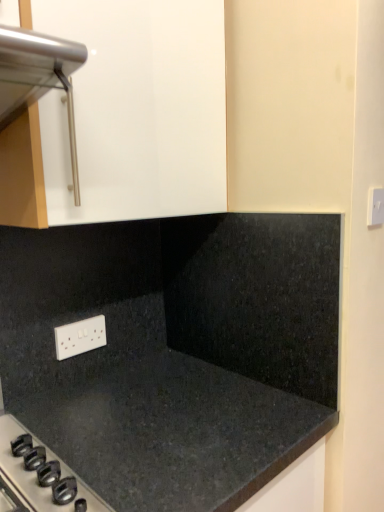
What is the approximate height of white plastic electric outlet at upper right, the 1th electric outlet in the top-to-bottom sequence?

3.45 inches.

The height and width of the screenshot is (512, 384). I want to click on black granite countertop at lower left, so click(x=175, y=351).

I want to click on white plastic electric outlet at lower left, placed as the second electric outlet when sorted from top to bottom, so click(80, 337).

Image resolution: width=384 pixels, height=512 pixels. I want to click on white plastic electric outlet at upper right, placed as the first electric outlet when sorted from front to back, so click(x=375, y=206).

Considering the relative sizes of white plastic electric outlet at lower left, marked as the first electric outlet in a bottom-to-top arrangement, and black granite countertop at lower left in the image provided, is white plastic electric outlet at lower left, marked as the first electric outlet in a bottom-to-top arrangement, shorter than black granite countertop at lower left?

Yes, white plastic electric outlet at lower left, marked as the first electric outlet in a bottom-to-top arrangement, is shorter than black granite countertop at lower left.

Is white plastic electric outlet at lower left, the second electric outlet in the front-to-back sequence, wider than black granite countertop at lower left?

No, white plastic electric outlet at lower left, the second electric outlet in the front-to-back sequence, is not wider than black granite countertop at lower left.

From the image's perspective, which electric outlet is the 1st one above the black granite countertop at lower left? Please provide its 2D coordinates.

[(80, 337)]

How many degrees apart are the facing directions of white plastic electric outlet at lower left, marked as the first electric outlet in a bottom-to-top arrangement, and black granite countertop at lower left?

There is a 0.499-degree angle between the facing directions of white plastic electric outlet at lower left, marked as the first electric outlet in a bottom-to-top arrangement, and black granite countertop at lower left.

Is white plastic electric outlet at upper right, placed as the first electric outlet when sorted from front to back, bigger or smaller than white plastic electric outlet at lower left, marked as the first electric outlet in a bottom-to-top arrangement?

In the image, white plastic electric outlet at upper right, placed as the first electric outlet when sorted from front to back, appears to be smaller than white plastic electric outlet at lower left, marked as the first electric outlet in a bottom-to-top arrangement.

Which is behind, white plastic electric outlet at upper right, placed as the first electric outlet when sorted from front to back, or white plastic electric outlet at lower left, placed as the second electric outlet when sorted from top to bottom?

Positioned behind is white plastic electric outlet at lower left, placed as the second electric outlet when sorted from top to bottom.

From the image's perspective, is white plastic electric outlet at upper right, marked as the second electric outlet in a back-to-front arrangement, over white plastic electric outlet at lower left, marked as the first electric outlet in a bottom-to-top arrangement?

Yes, from the image's perspective, white plastic electric outlet at upper right, marked as the second electric outlet in a back-to-front arrangement, is over white plastic electric outlet at lower left, marked as the first electric outlet in a bottom-to-top arrangement.

Looking at their sizes, would you say white plastic electric outlet at upper right, placed as the second electric outlet when sorted from bottom to top, is wider or thinner than white plastic electric outlet at lower left, positioned as the 1th electric outlet in left-to-right order?

In the image, white plastic electric outlet at upper right, placed as the second electric outlet when sorted from bottom to top, appears to be wider than white plastic electric outlet at lower left, positioned as the 1th electric outlet in left-to-right order.

Who is more distant, black granite countertop at lower left or white plastic electric outlet at upper right, marked as the second electric outlet in a back-to-front arrangement?

white plastic electric outlet at upper right, marked as the second electric outlet in a back-to-front arrangement, is behind.

Does black granite countertop at lower left contain white plastic electric outlet at upper right, marked as the second electric outlet in a back-to-front arrangement?

Actually, white plastic electric outlet at upper right, marked as the second electric outlet in a back-to-front arrangement, is outside black granite countertop at lower left.

From a real-world perspective, which is physically below, black granite countertop at lower left or white plastic electric outlet at upper right, which is the second electric outlet in left-to-right order?

In real-world perspective, black granite countertop at lower left is lower.

Considering the relative sizes of black granite countertop at lower left and white plastic electric outlet at upper right, placed as the first electric outlet when sorted from front to back, in the image provided, is black granite countertop at lower left thinner than white plastic electric outlet at upper right, placed as the first electric outlet when sorted from front to back,?

Incorrect, the width of black granite countertop at lower left is not less than that of white plastic electric outlet at upper right, placed as the first electric outlet when sorted from front to back.

Considering the relative positions of black granite countertop at lower left and white plastic electric outlet at lower left, positioned as the 1th electric outlet in left-to-right order, in the image provided, is black granite countertop at lower left in front of white plastic electric outlet at lower left, positioned as the 1th electric outlet in left-to-right order,?

Yes, black granite countertop at lower left is in front of white plastic electric outlet at lower left, positioned as the 1th electric outlet in left-to-right order.

Which is more distant, (273, 426) or (77, 335)?

Positioned behind is point (77, 335).

From their relative heights in the image, would you say black granite countertop at lower left is taller or shorter than white plastic electric outlet at lower left, the second electric outlet in the front-to-back sequence?

black granite countertop at lower left is taller than white plastic electric outlet at lower left, the second electric outlet in the front-to-back sequence.

From a real-world perspective, is black granite countertop at lower left physically below white plastic electric outlet at lower left, positioned as the 1th electric outlet in left-to-right order?

Yes, from a real-world perspective, black granite countertop at lower left is below white plastic electric outlet at lower left, positioned as the 1th electric outlet in left-to-right order.

Is white plastic electric outlet at upper right, which is the second electric outlet in left-to-right order, facing towards black granite countertop at lower left?

No, white plastic electric outlet at upper right, which is the second electric outlet in left-to-right order, is not oriented towards black granite countertop at lower left.

Identify the location of electric outlet that is the 2nd object located above the black granite countertop at lower left (from the image's perspective). The height and width of the screenshot is (512, 384). (375, 206).

Which object is positioned more to the left, white plastic electric outlet at upper right, placed as the first electric outlet when sorted from front to back, or black granite countertop at lower left?

From the viewer's perspective, black granite countertop at lower left appears more on the left side.

Is white plastic electric outlet at upper right, placed as the first electric outlet when sorted from front to back, a part of white plastic electric outlet at lower left, marked as the first electric outlet in a bottom-to-top arrangement?

No, white plastic electric outlet at upper right, placed as the first electric outlet when sorted from front to back, is not inside white plastic electric outlet at lower left, marked as the first electric outlet in a bottom-to-top arrangement.

Considering the positions of objects white plastic electric outlet at lower left, the second electric outlet in the front-to-back sequence, and white plastic electric outlet at upper right, marked as the second electric outlet in a back-to-front arrangement, in the image provided, who is more to the right, white plastic electric outlet at lower left, the second electric outlet in the front-to-back sequence, or white plastic electric outlet at upper right, marked as the second electric outlet in a back-to-front arrangement,?

white plastic electric outlet at upper right, marked as the second electric outlet in a back-to-front arrangement, is more to the right.

Is white plastic electric outlet at lower left, positioned as the 1th electric outlet in left-to-right order, in contact with white plastic electric outlet at upper right, the 1th electric outlet in the top-to-bottom sequence?

white plastic electric outlet at lower left, positioned as the 1th electric outlet in left-to-right order, and white plastic electric outlet at upper right, the 1th electric outlet in the top-to-bottom sequence, are clearly separated.

Considering the sizes of white plastic electric outlet at lower left, placed as the second electric outlet when sorted from top to bottom, and white plastic electric outlet at upper right, placed as the second electric outlet when sorted from bottom to top, in the image, is white plastic electric outlet at lower left, placed as the second electric outlet when sorted from top to bottom, wider or thinner than white plastic electric outlet at upper right, placed as the second electric outlet when sorted from bottom to top,?

Considering their sizes, white plastic electric outlet at lower left, placed as the second electric outlet when sorted from top to bottom, looks slimmer than white plastic electric outlet at upper right, placed as the second electric outlet when sorted from bottom to top.

This screenshot has width=384, height=512. Identify the location of the 2nd electric outlet behind when counting from the black granite countertop at lower left. click(80, 337).

Where is `electric outlet above the white plastic electric outlet at lower left, positioned as the 1th electric outlet in left-to-right order (from a real-world perspective)`? The image size is (384, 512). electric outlet above the white plastic electric outlet at lower left, positioned as the 1th electric outlet in left-to-right order (from a real-world perspective) is located at coordinates (375, 206).

Based on their spatial positions, is white plastic electric outlet at lower left, placed as the second electric outlet when sorted from top to bottom, or white plastic electric outlet at upper right, placed as the first electric outlet when sorted from front to back, closer to black granite countertop at lower left?

Based on the image, white plastic electric outlet at lower left, placed as the second electric outlet when sorted from top to bottom, appears to be nearer to black granite countertop at lower left.

Which object lies nearer to the anchor point white plastic electric outlet at upper right, marked as the second electric outlet in a back-to-front arrangement, white plastic electric outlet at lower left, the second electric outlet in the front-to-back sequence, or black granite countertop at lower left?

The object closer to white plastic electric outlet at upper right, marked as the second electric outlet in a back-to-front arrangement, is black granite countertop at lower left.

From the image, which object appears to be farther from white plastic electric outlet at upper right, placed as the second electric outlet when sorted from bottom to top, black granite countertop at lower left or white plastic electric outlet at lower left, positioned as the second electric outlet in right-to-left order?

Among the two, white plastic electric outlet at lower left, positioned as the second electric outlet in right-to-left order, is located further to white plastic electric outlet at upper right, placed as the second electric outlet when sorted from bottom to top.

Based on their spatial positions, is white plastic electric outlet at upper right, placed as the first electric outlet when sorted from front to back, or white plastic electric outlet at lower left, which is counted as the 1th electric outlet, starting from the back, further from black granite countertop at lower left?

The object further to black granite countertop at lower left is white plastic electric outlet at upper right, placed as the first electric outlet when sorted from front to back.

Looking at this image, when comparing their distances from white plastic electric outlet at lower left, which is counted as the 1th electric outlet, starting from the back, does black granite countertop at lower left or white plastic electric outlet at upper right, placed as the second electric outlet when sorted from bottom to top, seem further?

white plastic electric outlet at upper right, placed as the second electric outlet when sorted from bottom to top.

Considering their positions, is white plastic electric outlet at upper right, placed as the first electric outlet when sorted from front to back, positioned further to white plastic electric outlet at lower left, positioned as the 1th electric outlet in left-to-right order, than black granite countertop at lower left?

white plastic electric outlet at upper right, placed as the first electric outlet when sorted from front to back, is positioned further to the anchor white plastic electric outlet at lower left, positioned as the 1th electric outlet in left-to-right order.

Where is `electric outlet that lies between white plastic electric outlet at upper right, which is the first electric outlet in right-to-left order, and black granite countertop at lower left from top to bottom`? The image size is (384, 512). electric outlet that lies between white plastic electric outlet at upper right, which is the first electric outlet in right-to-left order, and black granite countertop at lower left from top to bottom is located at coordinates (80, 337).